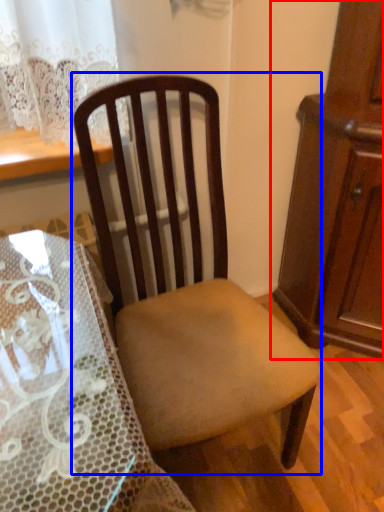
Question: Which of the following is the closest to the observer, cabinetry (highlighted by a red box) or chair (highlighted by a blue box)?

Choices:
 (A) cabinetry
 (B) chair

Answer: (B)